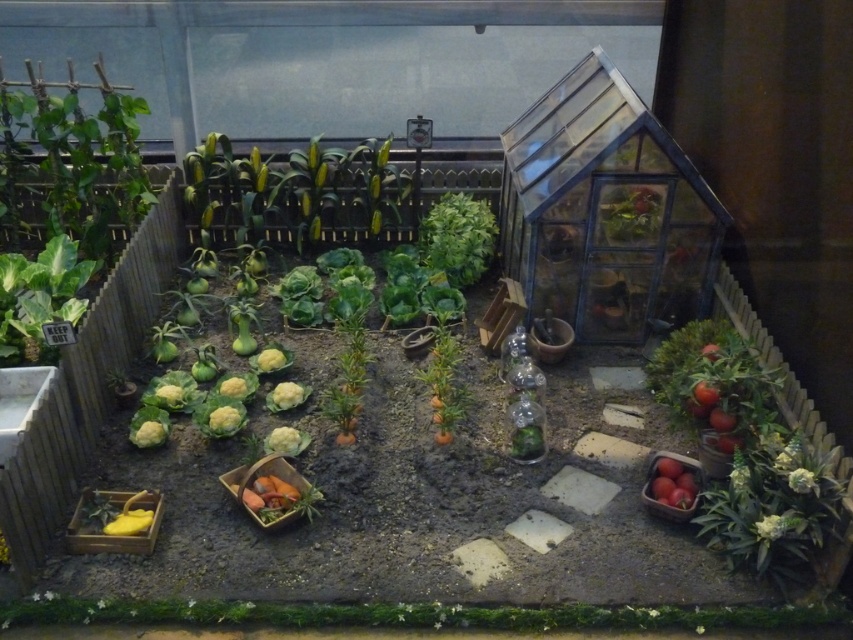
Question: Can you confirm if green leafy plant at left is wider than red matte tomatoes at lower right?

Choices:
 (A) no
 (B) yes

Answer: (B)

Question: Estimate the real-world distances between objects in this image. Which object is closer to the green leafy at center?

Choices:
 (A) red matte tomatoes at lower right
 (B) orange matte carrots at center
 (C) yellow-green leaves at upper center
 (D) green leafy plant at left

Answer: (B)

Question: Estimate the real-world distances between objects in this image. Which object is farther from the orange matte carrots at center?

Choices:
 (A) green leafy at center
 (B) yellow-green leaves at upper center
 (C) red matte tomatoes at lower right
 (D) green leafy plant at left

Answer: (D)

Question: Based on their relative distances, which object is nearer to the green leafy at center?

Choices:
 (A) yellow-green leaves at upper center
 (B) red matte tomatoes at lower right
 (C) green leafy plant at left
 (D) orange matte carrots at center

Answer: (D)

Question: Is green leafy plant at left behind green leafy at center?

Choices:
 (A) yes
 (B) no

Answer: (B)

Question: Considering the relative positions of green leafy plant at left and red matte tomatoes at lower right in the image provided, where is green leafy plant at left located with respect to red matte tomatoes at lower right?

Choices:
 (A) left
 (B) right

Answer: (A)